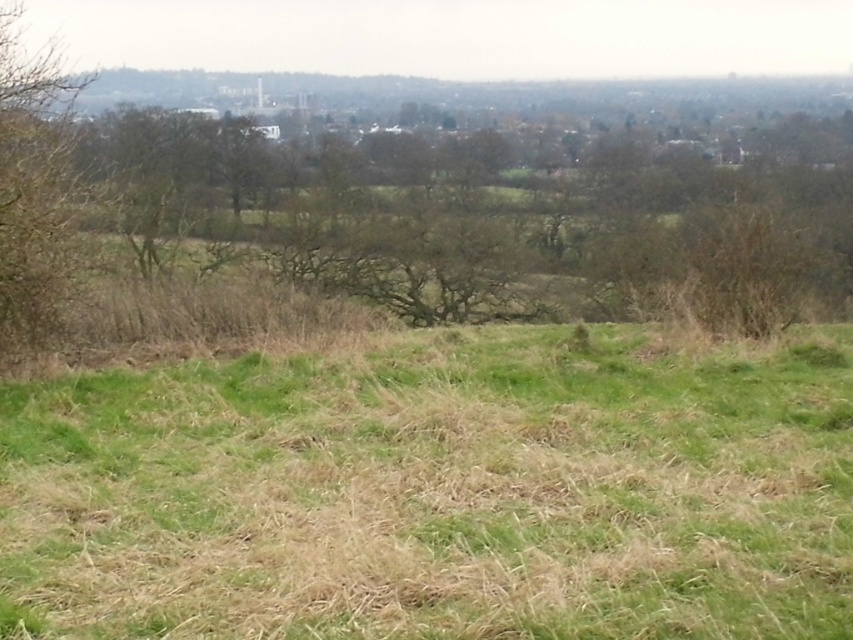
Can you confirm if brown leafless tree at center is taller than brown leafy tree at left?

Indeed, brown leafless tree at center has a greater height compared to brown leafy tree at left.

Does brown leafless tree at center appear over brown leafy tree at left?

Incorrect, brown leafless tree at center is not positioned above brown leafy tree at left.

Locate an element on the screen. brown leafless tree at center is located at coordinates (416, 195).

Does point (54, 428) come closer to viewer compared to point (22, 90)?

Yes, point (54, 428) is closer to viewer.

Is green grass at center taller than brown leafy tree at left?

Incorrect, green grass at center's height is not larger of brown leafy tree at left's.

Is point (427, 490) behind point (71, 122)?

No, it is in front of (71, 122).

Identify the location of green grass at center. This screenshot has width=853, height=640. (438, 490).

Does green grass at center appear on the right side of brown leafless tree at center?

Indeed, green grass at center is positioned on the right side of brown leafless tree at center.

Is green grass at center thinner than brown leafless tree at center?

Yes, green grass at center is thinner than brown leafless tree at center.

This screenshot has width=853, height=640. Find the location of `green grass at center`. green grass at center is located at coordinates (438, 490).